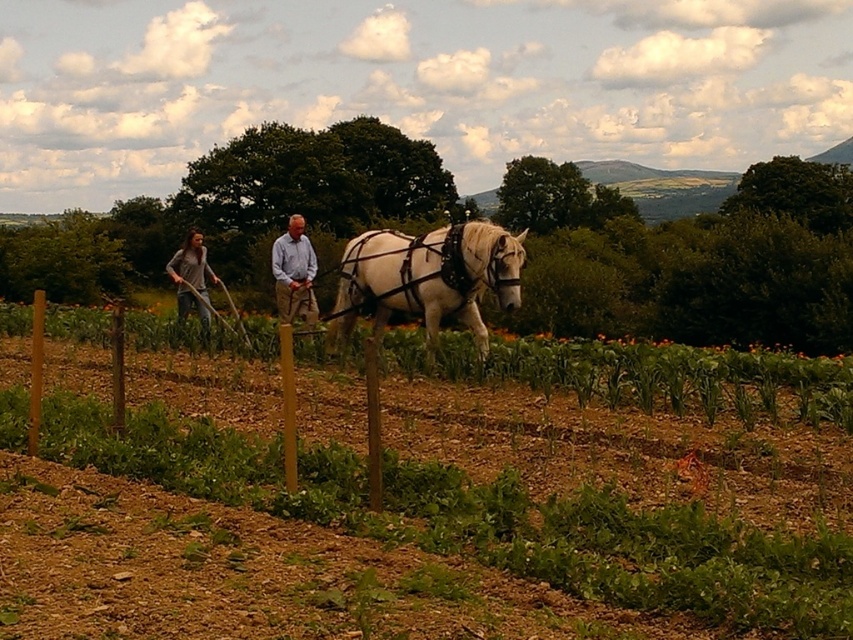
Question: Which object is the farthest from the light brown wooden coach at center?

Choices:
 (A) light brown cotton shirt at center
 (B) green leafy vines at center
 (C) gray cotton shirt at left
 (D) white glossy horse at center

Answer: (B)

Question: Among these objects, which one is farthest from the camera?

Choices:
 (A) light brown cotton shirt at center
 (B) green leafy vines at center
 (C) light brown wooden coach at center
 (D) gray cotton shirt at left

Answer: (D)

Question: Which object is closer to the camera taking this photo?

Choices:
 (A) light brown wooden coach at center
 (B) light brown cotton shirt at center
 (C) white glossy horse at center

Answer: (C)

Question: Is light brown wooden coach at center further to the viewer compared to gray cotton shirt at left?

Choices:
 (A) yes
 (B) no

Answer: (B)

Question: Is white glossy horse at center behind light brown wooden coach at center?

Choices:
 (A) no
 (B) yes

Answer: (A)

Question: Can you confirm if green leafy vines at center is wider than light brown cotton shirt at center?

Choices:
 (A) no
 (B) yes

Answer: (B)